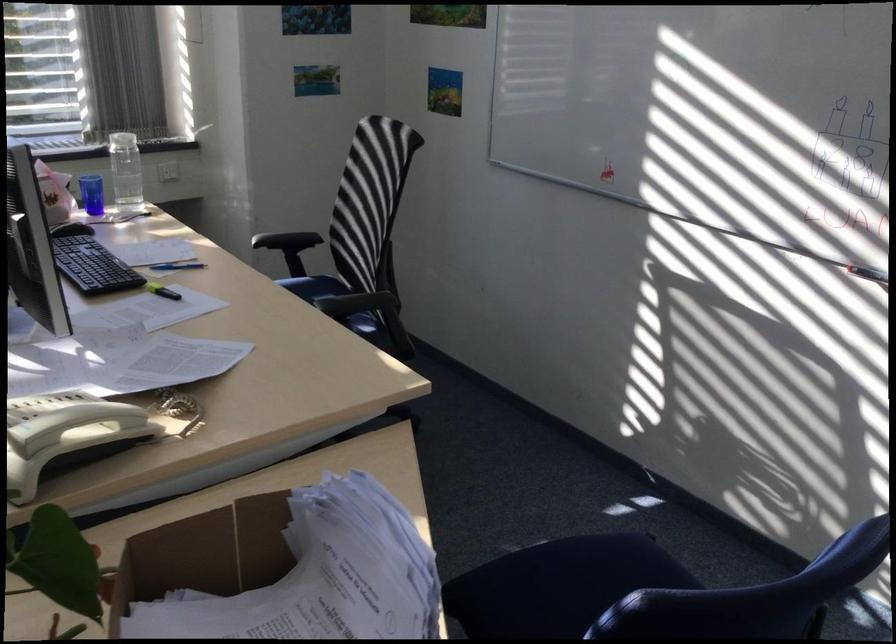
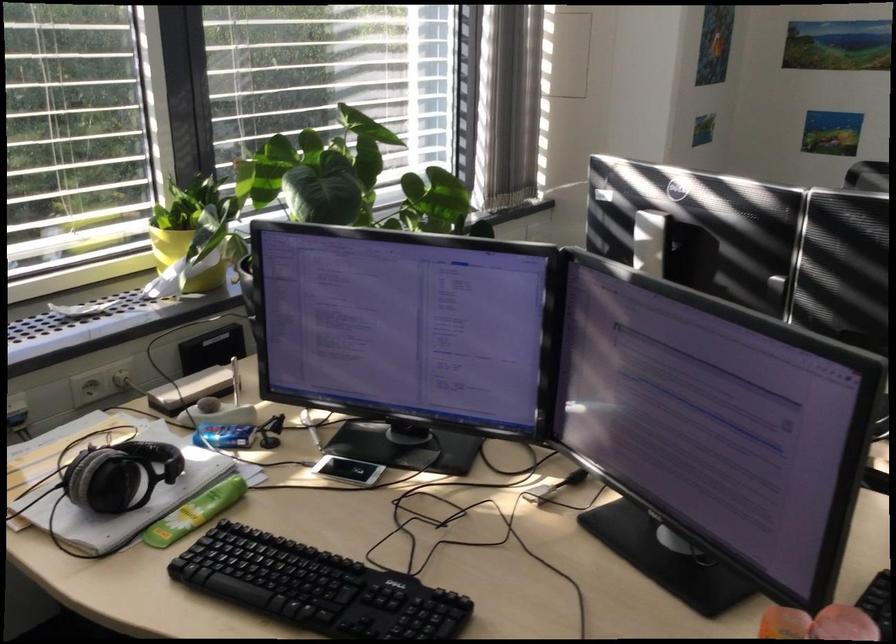
Question: In a continuous first-person perspective shot, in which direction is the camera moving?

Choices:
 (A) Left
 (B) Right
 (C) Forward
 (D) Backward

Answer: (A)